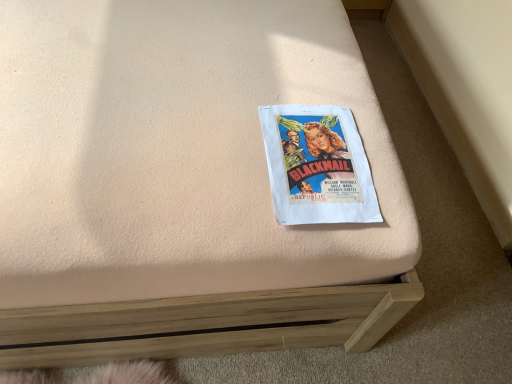
This screenshot has height=384, width=512. Identify the location of free space above matte paper poster at center (from a real-world perspective). (295, 134).